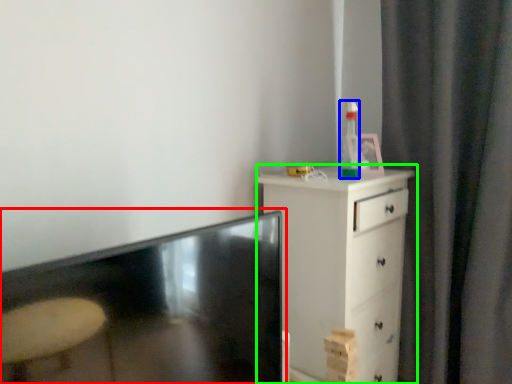
Question: Considering the real-world distances, which object is closest to table (highlighted by a red box)? bottle (highlighted by a blue box) or chest of drawers (highlighted by a green box).

Choices:
 (A) bottle
 (B) chest of drawers

Answer: (B)